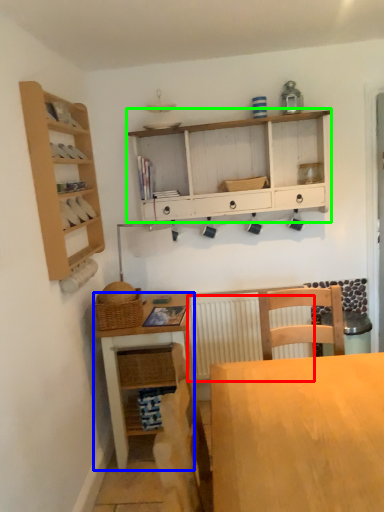
Question: Based on their relative distances, which object is farther from radiator (highlighted by a red box)? Choose from table (highlighted by a blue box) and cabinetry (highlighted by a green box).

Choices:
 (A) table
 (B) cabinetry

Answer: (B)